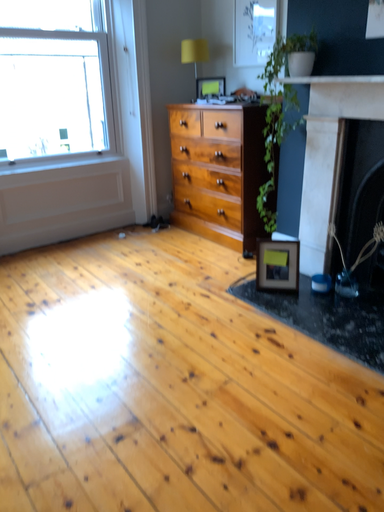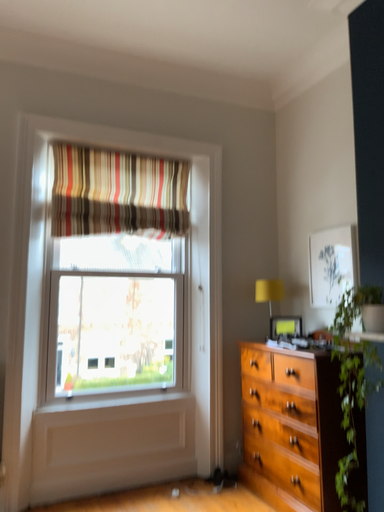
Question: Which way did the camera rotate in the video?

Choices:
 (A) rotated right
 (B) rotated left

Answer: (B)